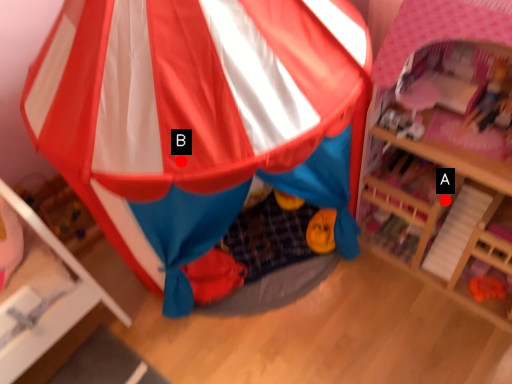
Question: Two points are circled on the image, labeled by A and B beside each circle. Among these points, which one is farthest from the camera?

Choices:
 (A) A is further
 (B) B is further

Answer: (A)